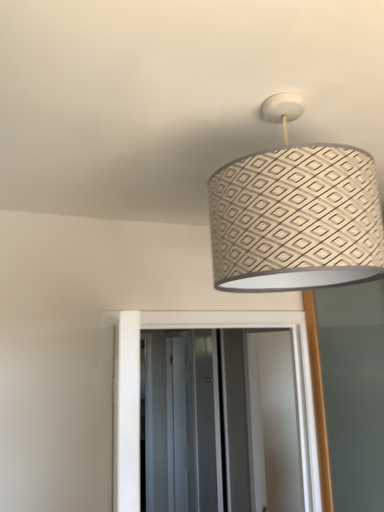
The height and width of the screenshot is (512, 384). Describe the element at coordinates (296, 219) in the screenshot. I see `patterned fabric lampshade at upper center` at that location.

At what (x,y) coordinates should I click in order to perform the action: click on patterned fabric lampshade at upper center. Please return your answer as a coordinate pair (x, y). This screenshot has width=384, height=512. Looking at the image, I should click on (296, 219).

Find the location of a particular element. The image size is (384, 512). patterned fabric lampshade at upper center is located at coordinates (296, 219).